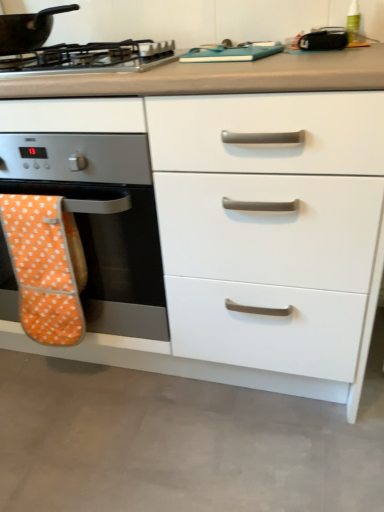
The height and width of the screenshot is (512, 384). Describe the element at coordinates (248, 233) in the screenshot. I see `white glossy drawer at center` at that location.

In order to face white glossy drawer at center, should I rotate leftwards or rightwards?

It's best to rotate left around 8.628 degrees.

Looking at this image, what is the approximate width of orange fabric oven mitt at left?

orange fabric oven mitt at left is 24.49 inches in width.

This screenshot has height=512, width=384. Describe the element at coordinates (45, 267) in the screenshot. I see `orange polka dot oven mitt at left` at that location.

In order to click on black matte pan at upper left in this screenshot , I will do `click(28, 29)`.

Identify the location of metallic silver gas stove at upper left. (93, 57).

What do you see at coordinates (93, 57) in the screenshot? I see `metallic silver gas stove at upper left` at bounding box center [93, 57].

Image resolution: width=384 pixels, height=512 pixels. In order to click on white glossy drawer at center in this screenshot , I will do `click(248, 233)`.

Find the location of a particular element. gas stove that is above the orange fabric oven mitt at left (from the image's perspective) is located at coordinates [93, 57].

Is metallic silver gas stove at upper left facing away from orange fabric oven mitt at left?

metallic silver gas stove at upper left does not have its back to orange fabric oven mitt at left.

Is metallic silver gas stove at upper left wider or thinner than orange fabric oven mitt at left?

Clearly, metallic silver gas stove at upper left has less width compared to orange fabric oven mitt at left.

Do you think metallic silver gas stove at upper left is within orange fabric oven mitt at left, or outside of it?

metallic silver gas stove at upper left is spatially situated outside orange fabric oven mitt at left.

Considering their positions, is orange polka dot oven mitt at left located in front of or behind black matte pan at upper left?

orange polka dot oven mitt at left is behind black matte pan at upper left.

Can you confirm if orange polka dot oven mitt at left is positioned to the left of black matte pan at upper left?

In fact, orange polka dot oven mitt at left is to the right of black matte pan at upper left.

From the image's perspective, who appears lower, orange polka dot oven mitt at left or black matte pan at upper left?

orange polka dot oven mitt at left.

Is orange polka dot oven mitt at left not within black matte pan at upper left?

Indeed, orange polka dot oven mitt at left is completely outside black matte pan at upper left.

Are metallic silver gas stove at upper left and orange polka dot oven mitt at left beside each other?

No, metallic silver gas stove at upper left is not beside orange polka dot oven mitt at left.

From a real-world perspective, is metallic silver gas stove at upper left above or below orange polka dot oven mitt at left?

metallic silver gas stove at upper left is situated higher than orange polka dot oven mitt at left in the real world.

Is metallic silver gas stove at upper left to the left of orange polka dot oven mitt at left from the viewer's perspective?

In fact, metallic silver gas stove at upper left is to the right of orange polka dot oven mitt at left.

Looking at the image, does metallic silver gas stove at upper left seem bigger or smaller compared to orange polka dot oven mitt at left?

Considering their sizes, metallic silver gas stove at upper left takes up more space than orange polka dot oven mitt at left.

From a real-world perspective, does orange polka dot oven mitt at left stand above metallic silver gas stove at upper left?

No, from a real-world perspective, orange polka dot oven mitt at left is not over metallic silver gas stove at upper left

Is orange polka dot oven mitt at left to the right of metallic silver gas stove at upper left from the viewer's perspective?

Incorrect, orange polka dot oven mitt at left is not on the right side of metallic silver gas stove at upper left.

Which of these two, orange polka dot oven mitt at left or metallic silver gas stove at upper left, is smaller?

Smaller between the two is orange polka dot oven mitt at left.

Can you confirm if orange polka dot oven mitt at left is shorter than metallic silver gas stove at upper left?

Incorrect, the height of orange polka dot oven mitt at left does not fall short of that of metallic silver gas stove at upper left.

From the image's perspective, is black matte pan at upper left above or below white glossy drawer at center?

From the image's perspective, black matte pan at upper left appears above white glossy drawer at center.

Considering the relative positions of black matte pan at upper left and white glossy drawer at center in the image provided, is black matte pan at upper left to the left or to the right of white glossy drawer at center?

In the image, black matte pan at upper left appears on the left side of white glossy drawer at center.

At what (x,y) coordinates should I click in order to perform the action: click on kitchen appliance above the white glossy drawer at center (from a real-world perspective). Please return your answer as a coordinate pair (x, y). The image size is (384, 512). Looking at the image, I should click on (28, 29).

Is black matte pan at upper left taller than white glossy drawer at center?

Incorrect, the height of black matte pan at upper left is not larger of that of white glossy drawer at center.

From a real-world perspective, which is physically above, white glossy drawer at center or black matte pan at upper left?

black matte pan at upper left, from a real-world perspective.

How distant is white glossy drawer at center from black matte pan at upper left?

27.99 inches.

Can you confirm if white glossy drawer at center is taller than black matte pan at upper left?

Correct, white glossy drawer at center is much taller as black matte pan at upper left.

Which is nearer, (317, 257) or (35, 44)?

Point (317, 257) appears to be closer to the viewer than point (35, 44).

Considering the positions of point (136, 51) and point (26, 37), is point (136, 51) closer or farther from the camera than point (26, 37)?

Point (136, 51) is closer to the camera than point (26, 37).

Which object is further away from the camera taking this photo, metallic silver gas stove at upper left or black matte pan at upper left?

black matte pan at upper left is more distant.

From the image's perspective, which is above, metallic silver gas stove at upper left or black matte pan at upper left?

black matte pan at upper left, from the image's perspective.

Locate an element on the screen. Image resolution: width=384 pixels, height=512 pixels. home appliance below the metallic silver gas stove at upper left (from the image's perspective) is located at coordinates (101, 220).

Locate an element on the screen. The image size is (384, 512). kitchen appliance on the left side of orange polka dot oven mitt at left is located at coordinates (28, 29).

Which object lies nearer to the anchor point white glossy drawer at center, orange fabric oven mitt at left or orange polka dot oven mitt at left?

orange fabric oven mitt at left is positioned closer to the anchor white glossy drawer at center.

Considering their positions, is white glossy drawer at center positioned further to metallic silver gas stove at upper left than orange fabric oven mitt at left?

Among the two, white glossy drawer at center is located further to metallic silver gas stove at upper left.

When comparing their distances from orange fabric oven mitt at left, does black matte pan at upper left or orange polka dot oven mitt at left seem further?

Based on the image, black matte pan at upper left appears to be further to orange fabric oven mitt at left.

When comparing their distances from orange fabric oven mitt at left, does orange polka dot oven mitt at left or white glossy drawer at center seem closer?

Based on the image, orange polka dot oven mitt at left appears to be nearer to orange fabric oven mitt at left.

Looking at the image, which one is located closer to black matte pan at upper left, orange polka dot oven mitt at left or metallic silver gas stove at upper left?

metallic silver gas stove at upper left lies closer to black matte pan at upper left than the other object.

From the image, which object appears to be nearer to black matte pan at upper left, metallic silver gas stove at upper left or orange polka dot oven mitt at left?

The object closer to black matte pan at upper left is metallic silver gas stove at upper left.

Based on their spatial positions, is white glossy drawer at center or metallic silver gas stove at upper left closer to orange fabric oven mitt at left?

The object closer to orange fabric oven mitt at left is white glossy drawer at center.

Considering their positions, is orange fabric oven mitt at left positioned further to orange polka dot oven mitt at left than white glossy drawer at center?

Among the two, white glossy drawer at center is located further to orange polka dot oven mitt at left.

At what (x,y) coordinates should I click in order to perform the action: click on home appliance between metallic silver gas stove at upper left and orange polka dot oven mitt at left from top to bottom. Please return your answer as a coordinate pair (x, y). The height and width of the screenshot is (512, 384). Looking at the image, I should click on (101, 220).

Locate an element on the screen. The width and height of the screenshot is (384, 512). the chest of drawers that lies between black matte pan at upper left and orange fabric oven mitt at left from top to bottom is located at coordinates (248, 233).

The height and width of the screenshot is (512, 384). I want to click on chest of drawers between metallic silver gas stove at upper left and orange polka dot oven mitt at left in the up-down direction, so click(x=248, y=233).

Locate an element on the screen. gas stove between black matte pan at upper left and orange fabric oven mitt at left in the vertical direction is located at coordinates (93, 57).